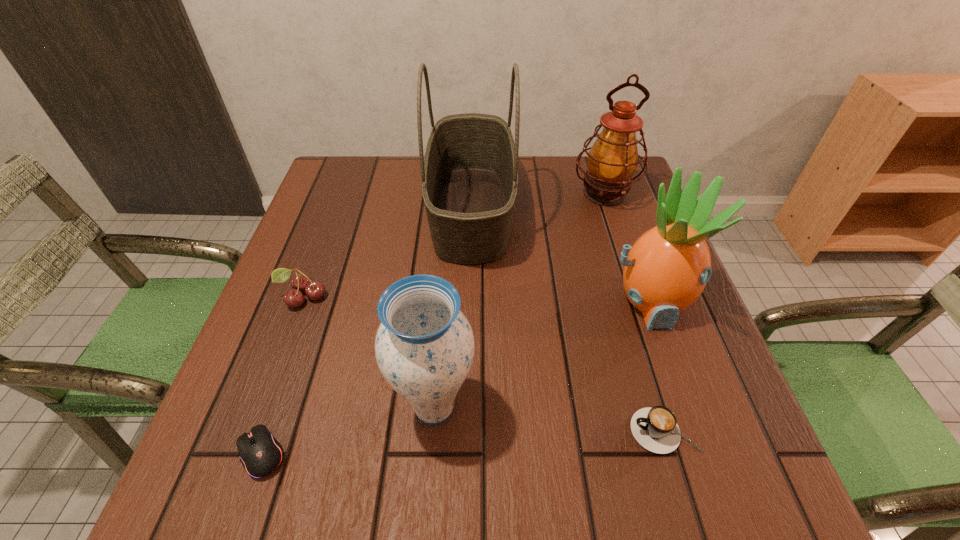
The height and width of the screenshot is (540, 960). Identify the location of cherry situated at the left edge. (300, 283).

Locate an element on the screen. The height and width of the screenshot is (540, 960). computer mouse present at the left edge is located at coordinates (260, 453).

The height and width of the screenshot is (540, 960). I want to click on oil lamp that is at the right edge, so click(612, 160).

The width and height of the screenshot is (960, 540). I want to click on pineapple at the right edge, so click(x=665, y=271).

Where is `cappuccino that is positioned at the right edge`? The height and width of the screenshot is (540, 960). cappuccino that is positioned at the right edge is located at coordinates (656, 429).

Identify the location of object located in the near left corner section of the desktop. (260, 453).

At what (x,y) coordinates should I click in order to perform the action: click on object present at the far right corner. Please return your answer as a coordinate pair (x, y). Image resolution: width=960 pixels, height=540 pixels. Looking at the image, I should click on (612, 160).

Locate an element on the screen. The image size is (960, 540). object located at the near right corner is located at coordinates (656, 429).

In the image, there is a desktop. Identify the location of free space at the far edge. The width and height of the screenshot is (960, 540). (387, 183).

Locate an element on the screen. The image size is (960, 540). vacant space at the near edge is located at coordinates (359, 484).